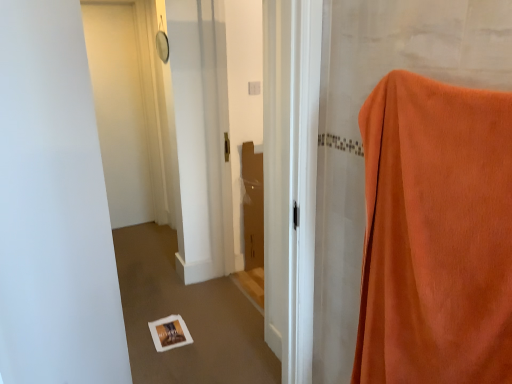
Question: From their relative heights in the image, would you say orange velvety curtain at right is taller or shorter than white matte door at upper left?

Choices:
 (A) tall
 (B) short

Answer: (B)

Question: Would you say orange velvety curtain at right is to the left or to the right of white matte door at upper left in the picture?

Choices:
 (A) left
 (B) right

Answer: (B)

Question: In the image, is orange velvety curtain at right positioned in front of or behind white matte door at upper left?

Choices:
 (A) behind
 (B) front

Answer: (B)

Question: From the image's perspective, is white matte door at upper left located above or below orange velvety curtain at right?

Choices:
 (A) below
 (B) above

Answer: (B)

Question: Is white matte door at upper left in front of or behind orange velvety curtain at right in the image?

Choices:
 (A) behind
 (B) front

Answer: (A)

Question: Based on their sizes in the image, would you say white matte door at upper left is bigger or smaller than orange velvety curtain at right?

Choices:
 (A) small
 (B) big

Answer: (A)

Question: Is white matte door at upper left wider or thinner than orange velvety curtain at right?

Choices:
 (A) wide
 (B) thin

Answer: (B)